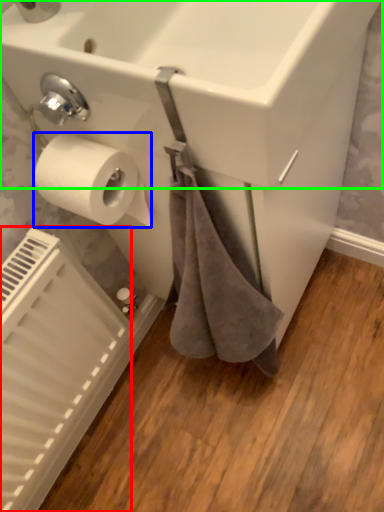
Question: Based on their relative distances, which object is nearer to radiator (highlighted by a red box)? Choose from toilet paper (highlighted by a blue box) and sink (highlighted by a green box).

Choices:
 (A) toilet paper
 (B) sink

Answer: (A)